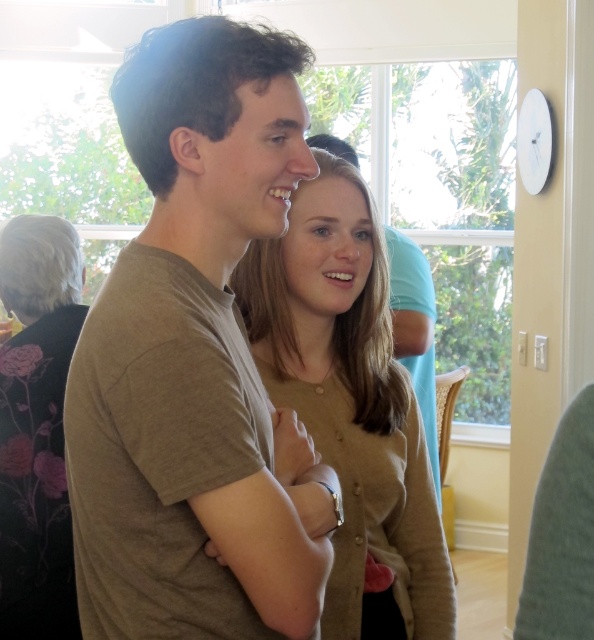
You are organizing a charity event and need to decide which outfit to display first. The black floral dress at left and the matte brown shirt at center are both candidates. Based on their widths, which one should you choose if you want to showcase a slimmer silhouette?

The black floral dress at left is thinner than the matte brown shirt at center, so it would be the better choice to showcase a slimmer silhouette.